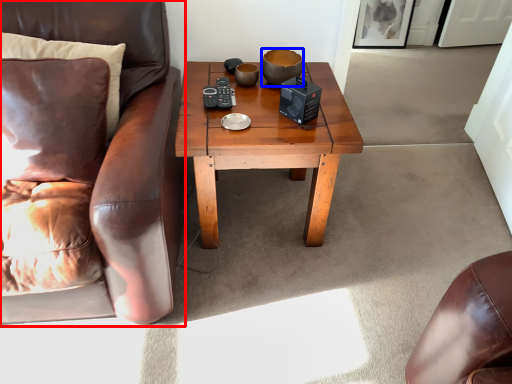
Question: Which object appears closest to the camera in this image, chair (highlighted by a red box) or bowl (highlighted by a blue box)?

Choices:
 (A) chair
 (B) bowl

Answer: (A)